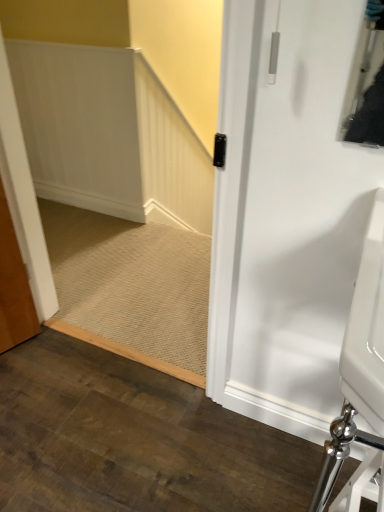
Question: From a real-world perspective, is beige carpet at center above or below white glossy sink at lower right?

Choices:
 (A) below
 (B) above

Answer: (A)

Question: Considering their positions, is beige carpet at center located in front of or behind white glossy sink at lower right?

Choices:
 (A) behind
 (B) front

Answer: (A)

Question: From the image's perspective, is beige carpet at center positioned above or below white glossy sink at lower right?

Choices:
 (A) below
 (B) above

Answer: (B)

Question: Looking at their shapes, would you say white glossy sink at lower right is wider or thinner than beige carpet at center?

Choices:
 (A) thin
 (B) wide

Answer: (A)

Question: Looking at the image, does white glossy sink at lower right seem bigger or smaller compared to beige carpet at center?

Choices:
 (A) small
 (B) big

Answer: (B)

Question: Choose the correct answer: Is white glossy sink at lower right inside beige carpet at center or outside it?

Choices:
 (A) inside
 (B) outside

Answer: (B)

Question: From their relative heights in the image, would you say white glossy sink at lower right is taller or shorter than beige carpet at center?

Choices:
 (A) tall
 (B) short

Answer: (A)